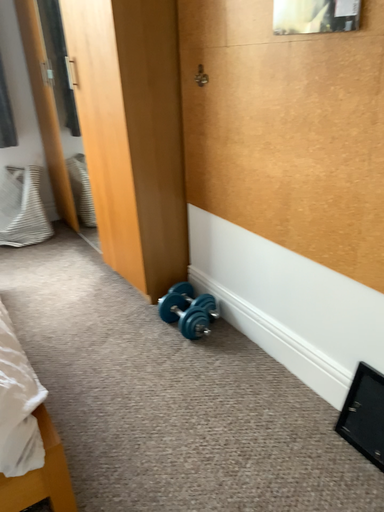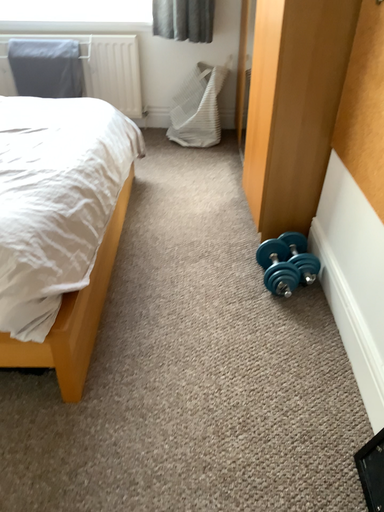
Question: How did the camera likely rotate when shooting the video?

Choices:
 (A) rotated left
 (B) rotated right

Answer: (A)